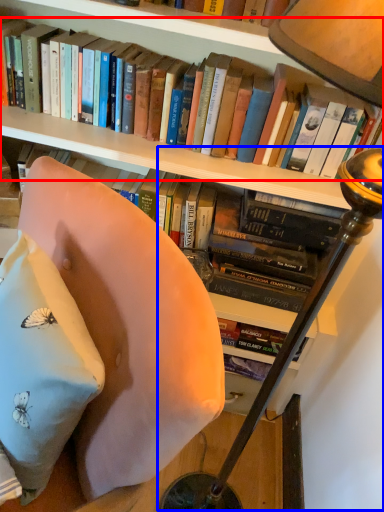
Question: Which object is further to the camera taking this photo, book (highlighted by a red box) or table lamp (highlighted by a blue box)?

Choices:
 (A) book
 (B) table lamp

Answer: (A)